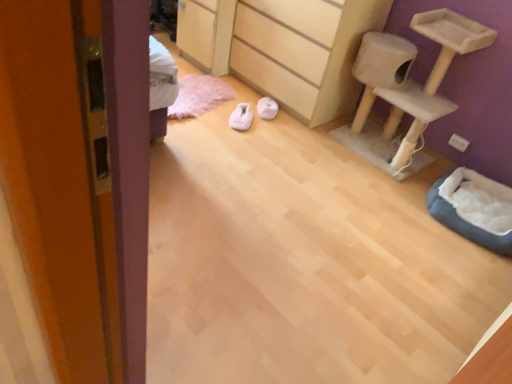
Image resolution: width=512 pixels, height=384 pixels. I want to click on beige carpeted cat tree at upper right, so click(412, 81).

What do you see at coordinates (412, 81) in the screenshot? The width and height of the screenshot is (512, 384). I see `beige carpeted cat tree at upper right` at bounding box center [412, 81].

The height and width of the screenshot is (384, 512). Describe the element at coordinates (267, 108) in the screenshot. I see `white fabric slipper at center, which is the second footwear from left to right` at that location.

This screenshot has height=384, width=512. I want to click on dark gray plush cat bed at lower right, so tap(464, 222).

What is the approximate height of light wood/texture chest of drawers at center?

The height of light wood/texture chest of drawers at center is 30.33 inches.

Image resolution: width=512 pixels, height=384 pixels. What do you see at coordinates (241, 117) in the screenshot? I see `white fabric slipper at center, arranged as the first footwear when viewed from the left` at bounding box center [241, 117].

Find the location of a particular element. This screenshot has width=512, height=384. beige carpeted cat tree at upper right is located at coordinates (412, 81).

At what (x,y) coordinates should I click in order to perform the action: click on chest of drawers that is on the left side of dark gray plush cat bed at lower right. Please return your answer as a coordinate pair (x, y). Looking at the image, I should click on (284, 48).

Which object is further away from the camera taking this photo, dark gray plush cat bed at lower right or light wood/texture chest of drawers at center?

Positioned behind is light wood/texture chest of drawers at center.

Considering the relative sizes of dark gray plush cat bed at lower right and light wood/texture chest of drawers at center in the image provided, is dark gray plush cat bed at lower right taller than light wood/texture chest of drawers at center?

No, dark gray plush cat bed at lower right is not taller than light wood/texture chest of drawers at center.

Is point (509, 252) positioned after point (220, 15)?

No, (509, 252) is in front of (220, 15).

Is light wood/texture chest of drawers at center oriented towards white fabric slipper at center, the second footwear positioned from the right?

Yes, light wood/texture chest of drawers at center is oriented towards white fabric slipper at center, the second footwear positioned from the right.

Between light wood/texture chest of drawers at center and white fabric slipper at center, arranged as the first footwear when viewed from the left, which one has smaller size?

white fabric slipper at center, arranged as the first footwear when viewed from the left, is smaller.

Considering the relative sizes of light wood/texture chest of drawers at center and white fabric slipper at center, the second footwear positioned from the right, in the image provided, is light wood/texture chest of drawers at center thinner than white fabric slipper at center, the second footwear positioned from the right,?

In fact, light wood/texture chest of drawers at center might be wider than white fabric slipper at center, the second footwear positioned from the right.

Are dark gray plush cat bed at lower right and white fabric slipper at center, which is the second footwear from left to right, located far from each other?

Yes, dark gray plush cat bed at lower right is far from white fabric slipper at center, which is the second footwear from left to right.

Would you say dark gray plush cat bed at lower right is inside or outside white fabric slipper at center, which is the second footwear from left to right?

dark gray plush cat bed at lower right exists outside the volume of white fabric slipper at center, which is the second footwear from left to right.

From the image's perspective, is dark gray plush cat bed at lower right under white fabric slipper at center, which is the second footwear from left to right?

Yes.

Between dark gray plush cat bed at lower right and white fabric slipper at center, which is the first footwear from right to left, which one appears on the left side from the viewer's perspective?

white fabric slipper at center, which is the first footwear from right to left, is more to the left.

Locate an element on the screen. The image size is (512, 384). cat bed on the right of light wood/texture chest of drawers at center is located at coordinates (464, 222).

Is light wood/texture chest of drawers at center thinner than dark gray plush cat bed at lower right?

In fact, light wood/texture chest of drawers at center might be wider than dark gray plush cat bed at lower right.

In the image, is light wood/texture chest of drawers at center positioned in front of or behind dark gray plush cat bed at lower right?

Clearly, light wood/texture chest of drawers at center is behind dark gray plush cat bed at lower right.

In the scene shown: Can you confirm if beige carpeted cat tree at upper right is taller than dark gray plush cat bed at lower right?

Correct, beige carpeted cat tree at upper right is much taller as dark gray plush cat bed at lower right.

Is beige carpeted cat tree at upper right facing away from dark gray plush cat bed at lower right?

beige carpeted cat tree at upper right does not have its back to dark gray plush cat bed at lower right.

Which of these two, beige carpeted cat tree at upper right or dark gray plush cat bed at lower right, is thinner?

With smaller width is beige carpeted cat tree at upper right.

Can you confirm if beige carpeted cat tree at upper right is positioned to the right of dark gray plush cat bed at lower right?

Incorrect, beige carpeted cat tree at upper right is not on the right side of dark gray plush cat bed at lower right.

From the image's perspective, would you say light wood/texture chest of drawers at center is shown under beige carpeted cat tree at upper right?

No, from the image's perspective, light wood/texture chest of drawers at center is not beneath beige carpeted cat tree at upper right.

Which is less distant, (353,6) or (482,47)?

Point (353,6).

In terms of height, does light wood/texture chest of drawers at center look taller or shorter compared to beige carpeted cat tree at upper right?

Considering their sizes, light wood/texture chest of drawers at center has less height than beige carpeted cat tree at upper right.

Looking at the image, does light wood/texture chest of drawers at center seem bigger or smaller compared to beige carpeted cat tree at upper right?

light wood/texture chest of drawers at center is bigger than beige carpeted cat tree at upper right.

Visually, is white fabric slipper at center, which is the second footwear from left to right, positioned to the left or to the right of dark gray plush cat bed at lower right?

white fabric slipper at center, which is the second footwear from left to right, is to the left of dark gray plush cat bed at lower right.

The image size is (512, 384). In order to click on footwear that is the 2nd object directly below the dark gray plush cat bed at lower right (from a real-world perspective) in this screenshot , I will do `click(267, 108)`.

From the image's perspective, between white fabric slipper at center, which is the second footwear from left to right, and dark gray plush cat bed at lower right, who is located below?

From the image's view, dark gray plush cat bed at lower right is below.

Could you tell me if white fabric slipper at center, which is the first footwear from right to left, is facing dark gray plush cat bed at lower right?

No, white fabric slipper at center, which is the first footwear from right to left, is not aimed at dark gray plush cat bed at lower right.

Where is `chest of drawers on the left of dark gray plush cat bed at lower right`? The image size is (512, 384). chest of drawers on the left of dark gray plush cat bed at lower right is located at coordinates (284, 48).

I want to click on chest of drawers on the right side of white fabric slipper at center, the second footwear positioned from the right, so 284,48.

Looking at the image, which one is located closer to dark gray plush cat bed at lower right, beige carpeted cat tree at upper right or light wood/texture chest of drawers at center?

The object closer to dark gray plush cat bed at lower right is beige carpeted cat tree at upper right.

Consider the image. When comparing their distances from white fabric slipper at center, arranged as the first footwear when viewed from the left, does white fabric slipper at center, which is the second footwear from left to right, or dark gray plush cat bed at lower right seem further?

dark gray plush cat bed at lower right.

Looking at this image, based on their spatial positions, is dark gray plush cat bed at lower right or white fabric slipper at center, the second footwear positioned from the right, further from beige carpeted cat tree at upper right?

Based on the image, white fabric slipper at center, the second footwear positioned from the right, appears to be further to beige carpeted cat tree at upper right.

Considering their positions, is dark gray plush cat bed at lower right positioned further to white fabric slipper at center, the second footwear positioned from the right, than white fabric slipper at center, which is the first footwear from right to left?

dark gray plush cat bed at lower right lies further to white fabric slipper at center, the second footwear positioned from the right, than the other object.

Considering their positions, is beige carpeted cat tree at upper right positioned closer to white fabric slipper at center, which is the second footwear from left to right, than dark gray plush cat bed at lower right?

beige carpeted cat tree at upper right lies closer to white fabric slipper at center, which is the second footwear from left to right, than the other object.

Based on their spatial positions, is light wood/texture chest of drawers at center or dark gray plush cat bed at lower right further from beige carpeted cat tree at upper right?

dark gray plush cat bed at lower right.

Estimate the real-world distances between objects in this image. Which object is closer to dark gray plush cat bed at lower right, light wood/texture chest of drawers at center or beige carpeted cat tree at upper right?

Based on the image, beige carpeted cat tree at upper right appears to be nearer to dark gray plush cat bed at lower right.

Estimate the real-world distances between objects in this image. Which object is further from beige carpeted cat tree at upper right, white fabric slipper at center, the second footwear positioned from the right, or white fabric slipper at center, which is the first footwear from right to left?

The object further to beige carpeted cat tree at upper right is white fabric slipper at center, the second footwear positioned from the right.

Locate an element on the screen. This screenshot has width=512, height=384. footwear between white fabric slipper at center, the second footwear positioned from the right, and dark gray plush cat bed at lower right, in the horizontal direction is located at coordinates (267, 108).

Find the location of a particular element. This screenshot has width=512, height=384. chest of drawers between white fabric slipper at center, which is the first footwear from right to left, and dark gray plush cat bed at lower right is located at coordinates (284, 48).

Identify the location of the chest of drawers positioned between beige carpeted cat tree at upper right and white fabric slipper at center, which is the second footwear from left to right, from near to far. (284, 48).

Where is `the chest of drawers located between white fabric slipper at center, the second footwear positioned from the right, and beige carpeted cat tree at upper right in the left-right direction`? The width and height of the screenshot is (512, 384). the chest of drawers located between white fabric slipper at center, the second footwear positioned from the right, and beige carpeted cat tree at upper right in the left-right direction is located at coordinates (284, 48).